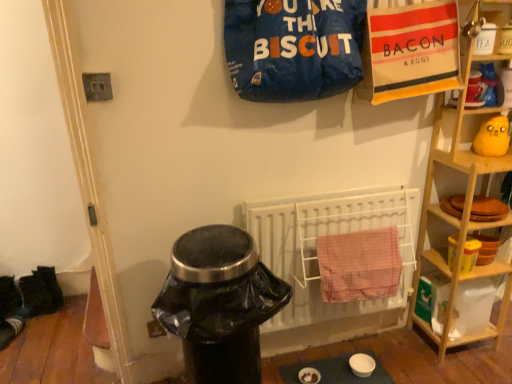
At what (x,y) coordinates should I click in order to perform the action: click on blank space situated above matte blue table at lower center (from a real-world perspective). Please return your answer as a coordinate pair (x, y). The height and width of the screenshot is (384, 512). Looking at the image, I should click on (329, 371).